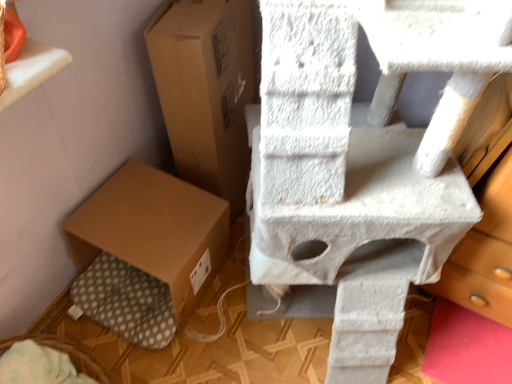
Find the location of `white textured cat tree at upper right`. white textured cat tree at upper right is located at coordinates (438, 59).

Which of these two, brown cardboard box at lower left, the second cardboard box in the top-to-bottom sequence, or white textured cat tree at upper right, stands shorter?

brown cardboard box at lower left, the second cardboard box in the top-to-bottom sequence, is shorter.

Which is in front, point (178, 280) or point (365, 27)?

The point (365, 27) is more forward.

Is brown cardboard box at lower left, arranged as the first cardboard box when ordered from the bottom, not near white textured cat tree at upper right?

That's not correct — brown cardboard box at lower left, arranged as the first cardboard box when ordered from the bottom, is a little close to white textured cat tree at upper right.

Considering the sizes of brown cardboard box at lower left, the second cardboard box in the top-to-bottom sequence, and white textured cat tree at upper right in the image, is brown cardboard box at lower left, the second cardboard box in the top-to-bottom sequence, bigger or smaller than white textured cat tree at upper right?

Clearly, brown cardboard box at lower left, the second cardboard box in the top-to-bottom sequence, is larger in size than white textured cat tree at upper right.

Considering the sizes of objects white textured cat tree at upper right and brown cardboard box at center, the 1th cardboard box when ordered from top to bottom, in the image provided, who is smaller, white textured cat tree at upper right or brown cardboard box at center, the 1th cardboard box when ordered from top to bottom,?

Smaller between the two is white textured cat tree at upper right.

Does white textured cat tree at upper right appear on the left side of brown cardboard box at center, marked as the 2th cardboard box in a bottom-to-top arrangement?

No, white textured cat tree at upper right is not to the left of brown cardboard box at center, marked as the 2th cardboard box in a bottom-to-top arrangement.

Is white textured cat tree at upper right closer to the viewer compared to brown cardboard box at center, the 1th cardboard box when ordered from top to bottom?

Yes.

Is brown cardboard box at center, marked as the 2th cardboard box in a bottom-to-top arrangement, completely or partially inside white textured cat tree at upper right?

No, brown cardboard box at center, marked as the 2th cardboard box in a bottom-to-top arrangement, is not surrounded by white textured cat tree at upper right.

Considering the relative positions of brown cardboard box at lower left, the second cardboard box in the top-to-bottom sequence, and brown cardboard box at center, the 1th cardboard box when ordered from top to bottom, in the image provided, is brown cardboard box at lower left, the second cardboard box in the top-to-bottom sequence, to the left of brown cardboard box at center, the 1th cardboard box when ordered from top to bottom, from the viewer's perspective?

Yes, brown cardboard box at lower left, the second cardboard box in the top-to-bottom sequence, is to the left of brown cardboard box at center, the 1th cardboard box when ordered from top to bottom.

Based on the photo, how many degrees apart are the facing directions of brown cardboard box at lower left, arranged as the first cardboard box when ordered from the bottom, and brown cardboard box at center, marked as the 2th cardboard box in a bottom-to-top arrangement?

There is a 0.000231-degree angle between the facing directions of brown cardboard box at lower left, arranged as the first cardboard box when ordered from the bottom, and brown cardboard box at center, marked as the 2th cardboard box in a bottom-to-top arrangement.

Is brown cardboard box at lower left, the second cardboard box in the top-to-bottom sequence, oriented away from brown cardboard box at center, marked as the 2th cardboard box in a bottom-to-top arrangement?

No.

From the image's perspective, which object appears higher, brown cardboard box at lower left, the second cardboard box in the top-to-bottom sequence, or brown cardboard box at center, marked as the 2th cardboard box in a bottom-to-top arrangement?

brown cardboard box at center, marked as the 2th cardboard box in a bottom-to-top arrangement, is shown above in the image.

Image resolution: width=512 pixels, height=384 pixels. What are the coordinates of `the 2nd cardboard box behind the white textured cat tree at upper right` in the screenshot? It's located at (152, 228).

How many degrees apart are the facing directions of white textured cat tree at upper right and brown cardboard box at lower left, the second cardboard box in the top-to-bottom sequence?

There is a 0.000766-degree angle between the facing directions of white textured cat tree at upper right and brown cardboard box at lower left, the second cardboard box in the top-to-bottom sequence.

Between white textured cat tree at upper right and brown cardboard box at lower left, arranged as the first cardboard box when ordered from the bottom, which one appears on the left side from the viewer's perspective?

brown cardboard box at lower left, arranged as the first cardboard box when ordered from the bottom, is more to the left.

Which object is wider, white textured cat tree at upper right or brown cardboard box at lower left, arranged as the first cardboard box when ordered from the bottom?

brown cardboard box at lower left, arranged as the first cardboard box when ordered from the bottom, is wider.

Which is farther from the camera, (237,59) or (143,218)?

Positioned behind is point (237,59).

The image size is (512, 384). I want to click on cardboard box below the brown cardboard box at center, marked as the 2th cardboard box in a bottom-to-top arrangement (from the image's perspective), so click(152, 228).

Is brown cardboard box at center, marked as the 2th cardboard box in a bottom-to-top arrangement, beside brown cardboard box at lower left, arranged as the first cardboard box when ordered from the bottom?

No, brown cardboard box at center, marked as the 2th cardboard box in a bottom-to-top arrangement, is not touching brown cardboard box at lower left, arranged as the first cardboard box when ordered from the bottom.

Is brown cardboard box at center, marked as the 2th cardboard box in a bottom-to-top arrangement, positioned beyond the bounds of white textured cat tree at upper right?

Yes, brown cardboard box at center, marked as the 2th cardboard box in a bottom-to-top arrangement, is not within white textured cat tree at upper right.

Is brown cardboard box at center, marked as the 2th cardboard box in a bottom-to-top arrangement, to the left of white textured cat tree at upper right from the viewer's perspective?

Correct, you'll find brown cardboard box at center, marked as the 2th cardboard box in a bottom-to-top arrangement, to the left of white textured cat tree at upper right.

Which object is more forward, brown cardboard box at center, marked as the 2th cardboard box in a bottom-to-top arrangement, or white textured cat tree at upper right?

white textured cat tree at upper right is more forward.

Does brown cardboard box at center, marked as the 2th cardboard box in a bottom-to-top arrangement, have a lesser height compared to white textured cat tree at upper right?

Yes.

This screenshot has width=512, height=384. What are the coordinates of `cardboard box that is the 2nd one below the white textured cat tree at upper right (from a real-world perspective)` in the screenshot? It's located at (152, 228).

At what (x,y) coordinates should I click in order to perform the action: click on table that appears in front of the brown cardboard box at center, the 1th cardboard box when ordered from top to bottom. Please return your answer as a coordinate pair (x, y). The width and height of the screenshot is (512, 384). Looking at the image, I should click on (438, 59).

Based on their spatial positions, is brown cardboard box at lower left, the second cardboard box in the top-to-bottom sequence, or brown cardboard box at center, marked as the 2th cardboard box in a bottom-to-top arrangement, closer to white textured cat tree at upper right?

The object closer to white textured cat tree at upper right is brown cardboard box at center, marked as the 2th cardboard box in a bottom-to-top arrangement.

From the image, which object appears to be nearer to brown cardboard box at lower left, arranged as the first cardboard box when ordered from the bottom, white textured cat tree at upper right or brown cardboard box at center, marked as the 2th cardboard box in a bottom-to-top arrangement?

brown cardboard box at center, marked as the 2th cardboard box in a bottom-to-top arrangement, is closer to brown cardboard box at lower left, arranged as the first cardboard box when ordered from the bottom.

Based on their spatial positions, is brown cardboard box at center, the 1th cardboard box when ordered from top to bottom, or brown cardboard box at lower left, the second cardboard box in the top-to-bottom sequence, further from white textured cat tree at upper right?

brown cardboard box at lower left, the second cardboard box in the top-to-bottom sequence, is further to white textured cat tree at upper right.

Based on their spatial positions, is brown cardboard box at lower left, the second cardboard box in the top-to-bottom sequence, or white textured cat tree at upper right closer to brown cardboard box at center, marked as the 2th cardboard box in a bottom-to-top arrangement?

brown cardboard box at lower left, the second cardboard box in the top-to-bottom sequence, is closer to brown cardboard box at center, marked as the 2th cardboard box in a bottom-to-top arrangement.

Based on their spatial positions, is white textured cat tree at upper right or brown cardboard box at lower left, the second cardboard box in the top-to-bottom sequence, closer to brown cardboard box at center, the 1th cardboard box when ordered from top to bottom?

Among the two, brown cardboard box at lower left, the second cardboard box in the top-to-bottom sequence, is located nearer to brown cardboard box at center, the 1th cardboard box when ordered from top to bottom.

Estimate the real-world distances between objects in this image. Which object is further from brown cardboard box at lower left, arranged as the first cardboard box when ordered from the bottom, brown cardboard box at center, marked as the 2th cardboard box in a bottom-to-top arrangement, or white textured cat tree at upper right?

Based on the image, white textured cat tree at upper right appears to be further to brown cardboard box at lower left, arranged as the first cardboard box when ordered from the bottom.

Where is `cardboard box between brown cardboard box at lower left, arranged as the first cardboard box when ordered from the bottom, and white textured cat tree at upper right, in the horizontal direction`? The image size is (512, 384). cardboard box between brown cardboard box at lower left, arranged as the first cardboard box when ordered from the bottom, and white textured cat tree at upper right, in the horizontal direction is located at coordinates (205, 90).